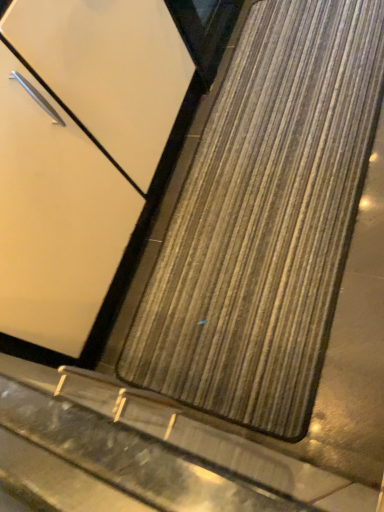
Describe the element at coordinates (55, 224) in the screenshot. This screenshot has width=384, height=512. I see `matte white door at center` at that location.

Locate an element on the screen. This screenshot has width=384, height=512. matte white door at center is located at coordinates (55, 224).

Measure the distance between matte white door at center and camera.

matte white door at center and camera are 38.87 inches apart.

What do you see at coordinates (266, 220) in the screenshot? I see `wooden mat at center` at bounding box center [266, 220].

In order to face wooden mat at center, should I rotate leftwards or rightwards?

Turn right approximately 10.891 degrees to face it.

Where is `wooden mat at center`? wooden mat at center is located at coordinates (266, 220).

Find the location of `matte white door at center`. matte white door at center is located at coordinates (55, 224).

Looking at this image, which object is positioned more to the right, wooden mat at center or matte white door at center?

wooden mat at center.

Consider the image. Is the position of wooden mat at center less distant than that of matte white door at center?

No, the depth of wooden mat at center is greater than that of matte white door at center.

Which is further, (203, 186) or (69, 286)?

Point (203, 186)

From the image's perspective, does wooden mat at center appear higher than matte white door at center?

No, from the image's perspective, wooden mat at center is not on top of matte white door at center.

Based on the photo, from a real-world perspective, does wooden mat at center stand above matte white door at center?

No, from a real-world perspective, wooden mat at center is not on top of matte white door at center.

Considering the sizes of objects wooden mat at center and matte white door at center in the image provided, who is thinner, wooden mat at center or matte white door at center?

With smaller width is matte white door at center.

Considering the relative sizes of wooden mat at center and matte white door at center in the image provided, is wooden mat at center shorter than matte white door at center?

Correct, wooden mat at center is not as tall as matte white door at center.

From the picture: Can you confirm if wooden mat at center is bigger than matte white door at center?

No.

Does wooden mat at center contain matte white door at center?

No, wooden mat at center does not contain matte white door at center.

Is wooden mat at center next to matte white door at center and touching it?

No, wooden mat at center is not touching matte white door at center.

Consider the image. Is matte white door at center at the back of wooden mat at center?

No, wooden mat at center is not facing away from matte white door at center.

Identify the location of door in front of the wooden mat at center. (55, 224).

Considering the relative positions of matte white door at center and wooden mat at center in the image provided, is matte white door at center to the left of wooden mat at center from the viewer's perspective?

Correct, you'll find matte white door at center to the left of wooden mat at center.

Which object is more forward, matte white door at center or wooden mat at center?

matte white door at center is more forward.

Is point (82, 338) closer to camera compared to point (316, 316)?

That is False.

From the image's perspective, does matte white door at center appear lower than wooden mat at center?

Actually, matte white door at center appears above wooden mat at center in the image.

From a real-world perspective, does matte white door at center stand above wooden mat at center?

Indeed, from a real-world perspective, matte white door at center stands above wooden mat at center.

Considering the sizes of objects matte white door at center and wooden mat at center in the image provided, who is thinner, matte white door at center or wooden mat at center?

Thinner between the two is matte white door at center.

Who is shorter, matte white door at center or wooden mat at center?

With less height is wooden mat at center.

In terms of size, does matte white door at center appear bigger or smaller than wooden mat at center?

Clearly, matte white door at center is larger in size than wooden mat at center.

Do you think matte white door at center is within wooden mat at center, or outside of it?

matte white door at center is outside wooden mat at center.

In the scene shown: Is there a large distance between matte white door at center and wooden mat at center?

That's not correct — matte white door at center is a little close to wooden mat at center.

Is wooden mat at center at the back of matte white door at center?

matte white door at center does not have its back to wooden mat at center.

How many degrees apart are the facing directions of matte white door at center and wooden mat at center?

The facing directions of matte white door at center and wooden mat at center are 90.1 degrees apart.

I want to click on mat that is under the matte white door at center (from a real-world perspective), so click(x=266, y=220).

Locate an element on the screen. This screenshot has height=512, width=384. door above the wooden mat at center (from a real-world perspective) is located at coordinates (55, 224).

You are a GUI agent. You are given a task and a screenshot of the screen. Output one action in this format:
    pyautogui.click(x=<x>, y=<y>)
    Task: Click on the door located on the left of wooden mat at center
    This screenshot has width=384, height=512.
    Given the screenshot: What is the action you would take?
    pyautogui.click(x=55, y=224)